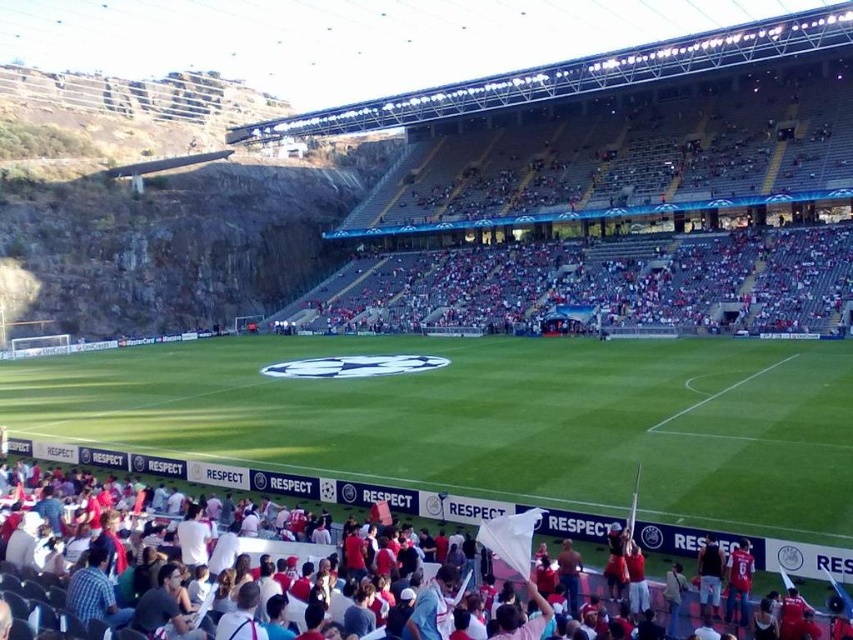
Which is behind, point (824, 547) or point (740, 540)?

Point (740, 540)

Who is taller, white fabric crowd at lower left or blue jersey at lower right?

white fabric crowd at lower left is taller.

Identify the location of white fabric crowd at lower left. The image size is (853, 640). (519, 529).